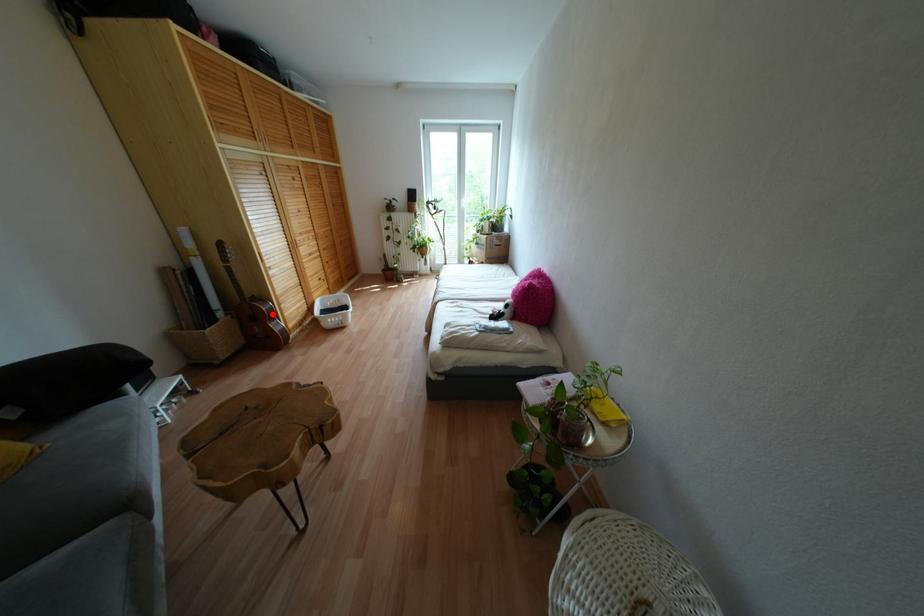
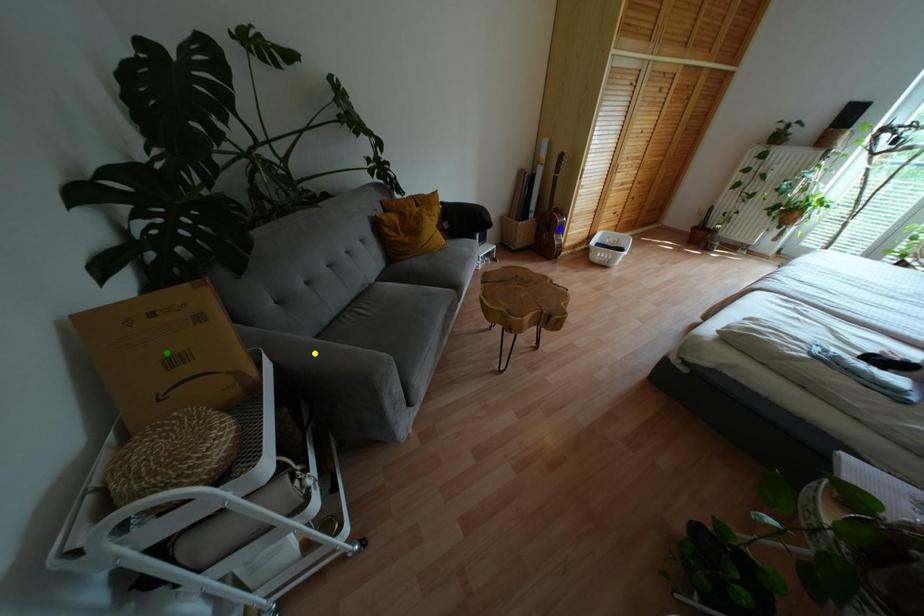
Question: I am providing you with two images of the same scene from different viewpoints. A red point is marked on the first image. You are given multiple points on the second image. Which spot in image 2 lines up with the point in image 1?

Choices:
 (A) yellow point
 (B) green point
 (C) blue point

Answer: (C)